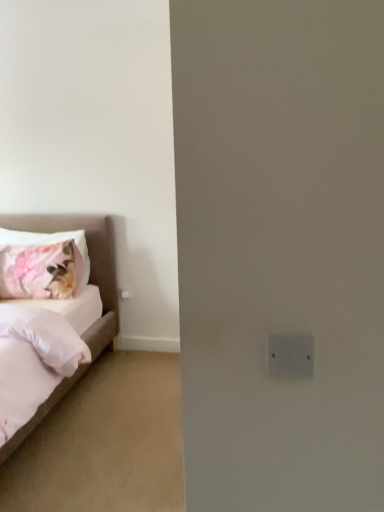
Identify the location of white fabric bed at left. (90, 263).

This screenshot has width=384, height=512. Describe the element at coordinates (90, 263) in the screenshot. I see `white fabric bed at left` at that location.

Where is `floral fabric pillow at left`? floral fabric pillow at left is located at coordinates (42, 264).

What do you see at coordinates (42, 264) in the screenshot? This screenshot has height=512, width=384. I see `floral fabric pillow at left` at bounding box center [42, 264].

The height and width of the screenshot is (512, 384). In order to click on white fabric bed at left in this screenshot , I will do `click(90, 263)`.

Considering the positions of objects floral fabric pillow at left and white fabric bed at left in the image provided, who is more to the right, floral fabric pillow at left or white fabric bed at left?

Positioned to the right is floral fabric pillow at left.

Is the depth of floral fabric pillow at left greater than that of white fabric bed at left?

Yes, floral fabric pillow at left is behind white fabric bed at left.

Which is in front, point (58, 279) or point (106, 346)?

Point (58, 279)

From the image's perspective, which is below, floral fabric pillow at left or white fabric bed at left?

white fabric bed at left is shown below in the image.

From a real-world perspective, between floral fabric pillow at left and white fabric bed at left, who is vertically higher?

floral fabric pillow at left.

Looking at their sizes, would you say floral fabric pillow at left is wider or thinner than white fabric bed at left?

Considering their sizes, floral fabric pillow at left looks slimmer than white fabric bed at left.

Does floral fabric pillow at left have a greater height compared to white fabric bed at left?

No.

Looking at this image, can you confirm if floral fabric pillow at left is bigger than white fabric bed at left?

Incorrect, floral fabric pillow at left is not larger than white fabric bed at left.

Is floral fabric pillow at left not inside white fabric bed at left?

No, floral fabric pillow at left is not entirely external to white fabric bed at left.

Is floral fabric pillow at left with white fabric bed at left?

floral fabric pillow at left and white fabric bed at left are clearly separated.

Is floral fabric pillow at left facing away from white fabric bed at left?

Yes, floral fabric pillow at left is positioned with its back facing white fabric bed at left.

How many degrees apart are the facing directions of floral fabric pillow at left and white fabric bed at left?

The angular difference between floral fabric pillow at left and white fabric bed at left is 4.59 degrees.

Where is `bed on the left of floral fabric pillow at left`? The image size is (384, 512). bed on the left of floral fabric pillow at left is located at coordinates (90, 263).

Considering the relative positions of white fabric bed at left and floral fabric pillow at left in the image provided, is white fabric bed at left to the left of floral fabric pillow at left from the viewer's perspective?

Indeed, white fabric bed at left is positioned on the left side of floral fabric pillow at left.

Which object is closer to the camera, white fabric bed at left or floral fabric pillow at left?

white fabric bed at left is in front.

Which point is more distant from viewer, (91, 280) or (70, 246)?

The point (91, 280) is more distant.

From the image's perspective, which one is positioned higher, white fabric bed at left or floral fabric pillow at left?

From the image's view, floral fabric pillow at left is above.

From a real-world perspective, is white fabric bed at left above or below floral fabric pillow at left?

Clearly, from a real-world perspective, white fabric bed at left is below floral fabric pillow at left.

Is white fabric bed at left thinner than floral fabric pillow at left?

In fact, white fabric bed at left might be wider than floral fabric pillow at left.

Based on the photo, in terms of height, does white fabric bed at left look taller or shorter compared to floral fabric pillow at left?

white fabric bed at left is taller than floral fabric pillow at left.

Between white fabric bed at left and floral fabric pillow at left, which one has larger size?

Bigger between the two is white fabric bed at left.

Is white fabric bed at left inside or outside of floral fabric pillow at left?

white fabric bed at left is spatially situated outside floral fabric pillow at left.

Is white fabric bed at left not near floral fabric pillow at left?

No, white fabric bed at left is in close proximity to floral fabric pillow at left.

Does white fabric bed at left turn towards floral fabric pillow at left?

No.

I want to click on pillow above the white fabric bed at left (from a real-world perspective), so click(42, 264).

Image resolution: width=384 pixels, height=512 pixels. I want to click on bed below the floral fabric pillow at left (from the image's perspective), so click(x=90, y=263).

At what (x,y) coordinates should I click in order to perform the action: click on pillow on the right of white fabric bed at left. Please return your answer as a coordinate pair (x, y). Looking at the image, I should click on coord(42,264).